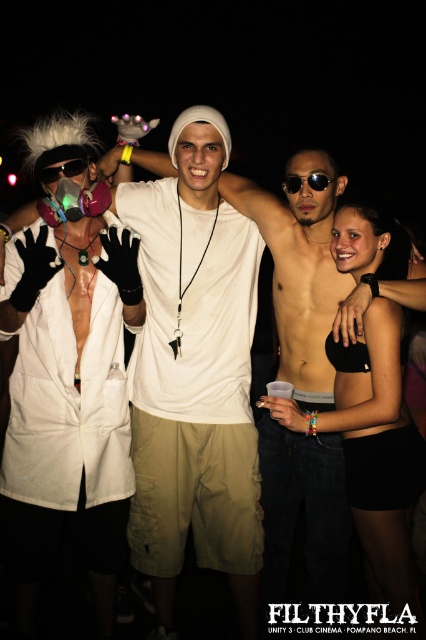
You are a photographer at Club Cinema in Pompano Beach, Florida, and you need to capture a photo of the white lab coat at center and the black matte bikini bottom at center. Which object should you focus on first if you want to ensure both are in sharp focus, considering their sizes?

The white lab coat at center is larger in size than the black matte bikini bottom at center, so focusing on the white lab coat at center first would help ensure both are in sharp focus since it is the larger object.

You are standing in the middle of the party at Club Cinema. There are two points marked in the image. One is at point (11, 483) and the other is at point (380, 212). Which point is closer to you?

Point (11, 483) is closer to you because it is further to the viewer than point (380, 212).

You are standing at the center of the scene. There is a white lab coat at center and a person wearing a white jacket on the far left. Which one is closer to you?

The white lab coat at center is closer to you since it is at the center, while the person in the white jacket is on the far left, making them farther away.